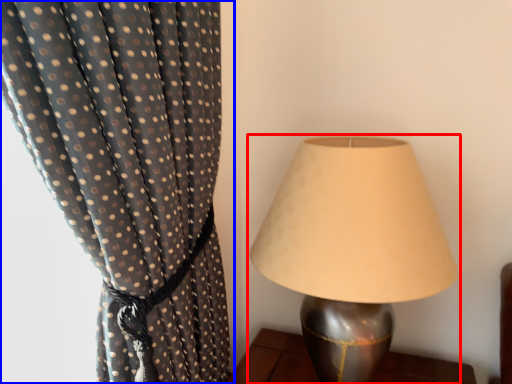
Question: Among these objects, which one is farthest to the camera, lamp (highlighted by a red box) or curtain (highlighted by a blue box)?

Choices:
 (A) lamp
 (B) curtain

Answer: (A)